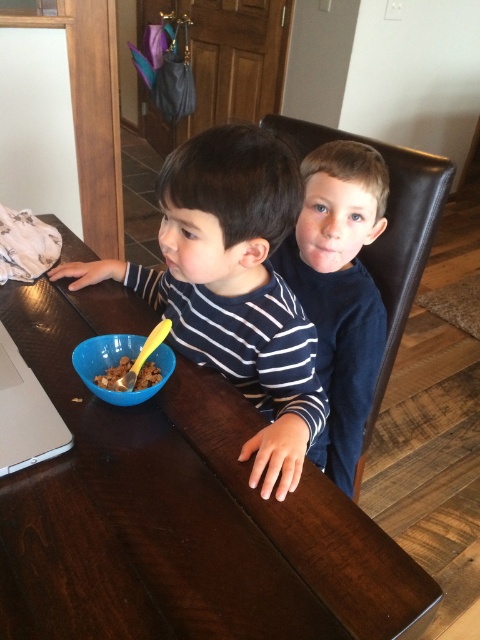
Is point (220, 324) farther from viewer compared to point (51, 403)?

Yes.

Is striped cotton shirt at center smaller than silver metallic laptop at left?

Actually, striped cotton shirt at center might be larger than silver metallic laptop at left.

I want to click on striped cotton shirt at center, so click(233, 285).

Can you confirm if dark blue shirt at center is bigger than blue plastic bowl at center?

Indeed, dark blue shirt at center has a larger size compared to blue plastic bowl at center.

Which is behind, point (331, 307) or point (152, 392)?

Point (331, 307)

I want to click on dark blue shirt at center, so click(339, 291).

Between point (325, 328) and point (159, 371), which one is positioned behind?

Point (325, 328)

Which is more to the right, dark blue shirt at center or brown crumbly cereal at lower left?

dark blue shirt at center

At what (x,y) coordinates should I click in order to perform the action: click on dark blue shirt at center. Please return your answer as a coordinate pair (x, y). The height and width of the screenshot is (640, 480). Looking at the image, I should click on (339, 291).